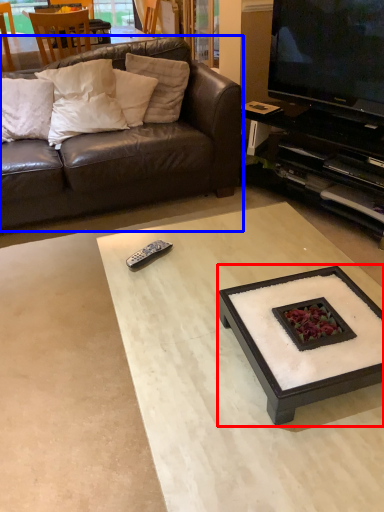
Question: Which point is further to the camera, coffee table (highlighted by a red box) or studio couch (highlighted by a blue box)?

Choices:
 (A) coffee table
 (B) studio couch

Answer: (B)